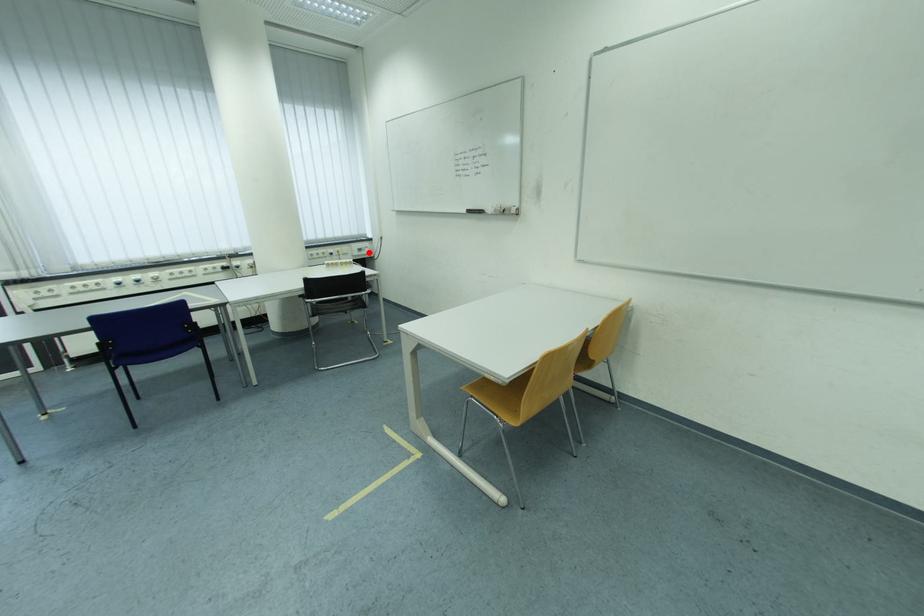
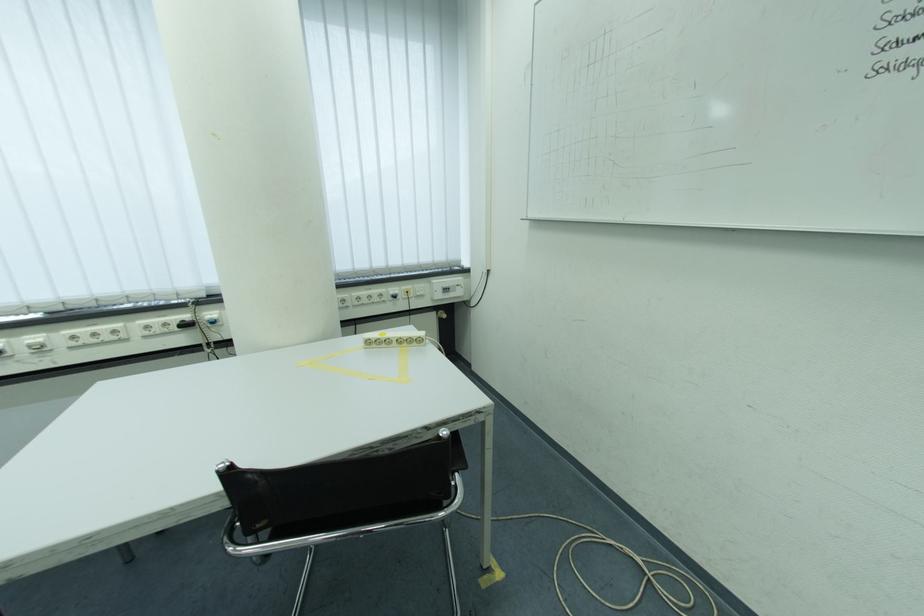
Where in the second image is the point corresponding to the highlighted location from the first image?

(455, 292)